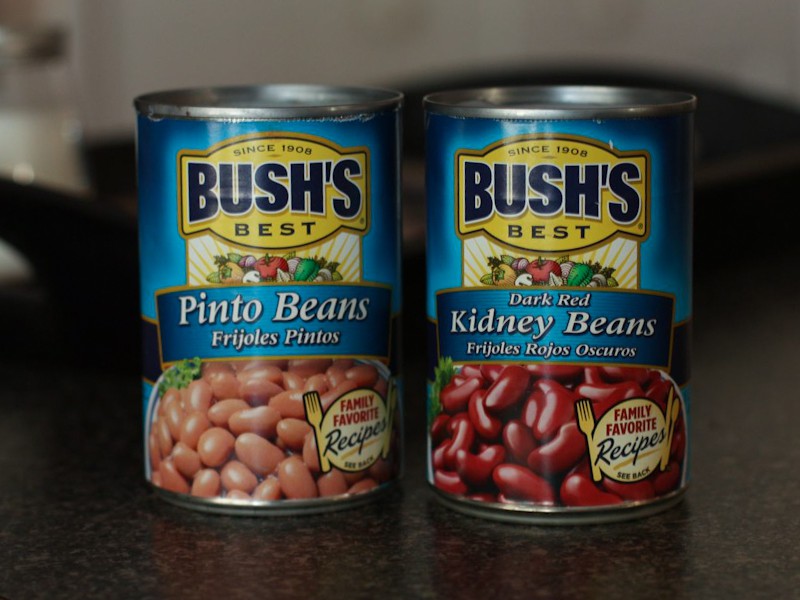
Find the location of `2 spoons`. 2 spoons is located at coordinates (394, 397), (676, 412).